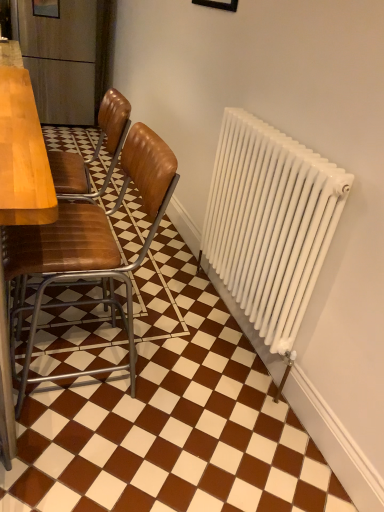
This screenshot has width=384, height=512. In order to click on space that is in front of brown leather chair at left in this screenshot , I will do point(85,455).